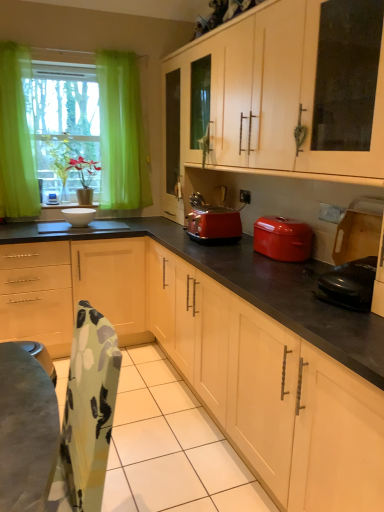
Question: Does matte wood cabinets at center, acting as the second cabinetry starting from the top, lie behind green sheer curtain at left?

Choices:
 (A) no
 (B) yes

Answer: (A)

Question: Can you confirm if matte wood cabinets at center, acting as the second cabinetry starting from the top, is thinner than green sheer curtain at left?

Choices:
 (A) no
 (B) yes

Answer: (A)

Question: From the image's perspective, is matte wood cabinets at center, the 1th cabinetry when ordered from bottom to top, under green sheer curtain at left?

Choices:
 (A) no
 (B) yes

Answer: (B)

Question: Is matte wood cabinets at center, acting as the second cabinetry starting from the top, taller than green sheer curtain at left?

Choices:
 (A) yes
 (B) no

Answer: (B)

Question: Is matte wood cabinets at center, the 1th cabinetry when ordered from bottom to top, aimed at green sheer curtain at left?

Choices:
 (A) yes
 (B) no

Answer: (B)

Question: Is black glossy electric kettle at lower right, marked as the 1th appliance in a right-to-left arrangement, to the left or to the right of shiny red toaster at center in the image?

Choices:
 (A) left
 (B) right

Answer: (B)

Question: Based on their sizes in the image, would you say black glossy electric kettle at lower right, marked as the 2th appliance in a left-to-right arrangement, is bigger or smaller than shiny red toaster at center?

Choices:
 (A) small
 (B) big

Answer: (A)

Question: From a real-world perspective, is black glossy electric kettle at lower right, marked as the 2th appliance in a left-to-right arrangement, physically located above or below shiny red toaster at center?

Choices:
 (A) below
 (B) above

Answer: (A)

Question: Do you think black glossy electric kettle at lower right, marked as the 1th appliance in a right-to-left arrangement, is within shiny red toaster at center, or outside of it?

Choices:
 (A) outside
 (B) inside

Answer: (A)

Question: In terms of width, does matte wood cabinets at center, the 1th cabinetry when ordered from bottom to top, look wider or thinner when compared to white matte cabinet at upper center, which appears as the 1th cabinetry when viewed from the top?

Choices:
 (A) wide
 (B) thin

Answer: (A)

Question: From the image's perspective, is matte wood cabinets at center, acting as the second cabinetry starting from the top, above or below white matte cabinet at upper center, the second cabinetry ordered from the bottom?

Choices:
 (A) above
 (B) below

Answer: (B)

Question: Would you say matte wood cabinets at center, acting as the second cabinetry starting from the top, is inside or outside white matte cabinet at upper center, the second cabinetry ordered from the bottom?

Choices:
 (A) outside
 (B) inside

Answer: (A)

Question: Is matte wood cabinets at center, acting as the second cabinetry starting from the top, to the left or to the right of white matte cabinet at upper center, which appears as the 1th cabinetry when viewed from the top, in the image?

Choices:
 (A) left
 (B) right

Answer: (A)

Question: Is point (92, 210) closer or farther from the camera than point (220, 146)?

Choices:
 (A) closer
 (B) farther

Answer: (B)

Question: Is white glossy bowl at center, the first appliance when ordered from top to bottom, inside the boundaries of white matte cabinet at upper center, the second cabinetry ordered from the bottom, or outside?

Choices:
 (A) inside
 (B) outside

Answer: (B)